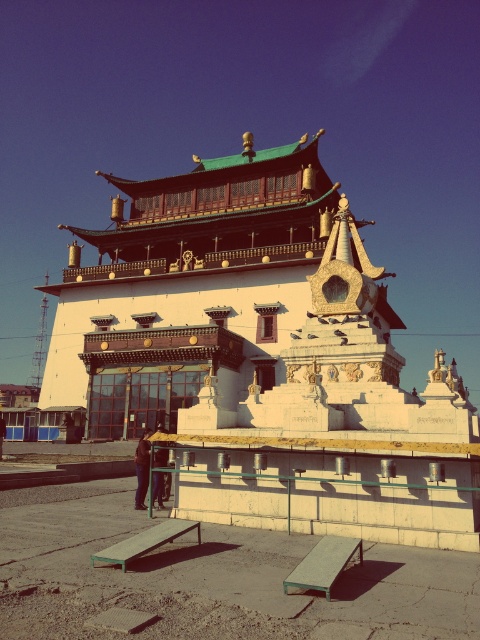
Question: Among these points, which one is nearest to the camera?

Choices:
 (A) (292, 572)
 (B) (120, 554)

Answer: (A)

Question: Is green matte picnic table at lower center positioned in front of dark brown leather jacket at lower center?

Choices:
 (A) yes
 (B) no

Answer: (A)

Question: Which object is positioned closest to the dark brown leather jacket at lower center?

Choices:
 (A) green matte picnic table at lower center
 (B) green painted wood picnic table at lower center

Answer: (A)

Question: Among these objects, which one is nearest to the camera?

Choices:
 (A) green matte picnic table at lower center
 (B) dark brown leather jacket at lower center

Answer: (A)

Question: Does green painted wood picnic table at lower center have a lesser width compared to green matte picnic table at lower center?

Choices:
 (A) no
 (B) yes

Answer: (A)

Question: Is the position of green painted wood picnic table at lower center less distant than that of dark brown leather jacket at lower center?

Choices:
 (A) no
 (B) yes

Answer: (B)